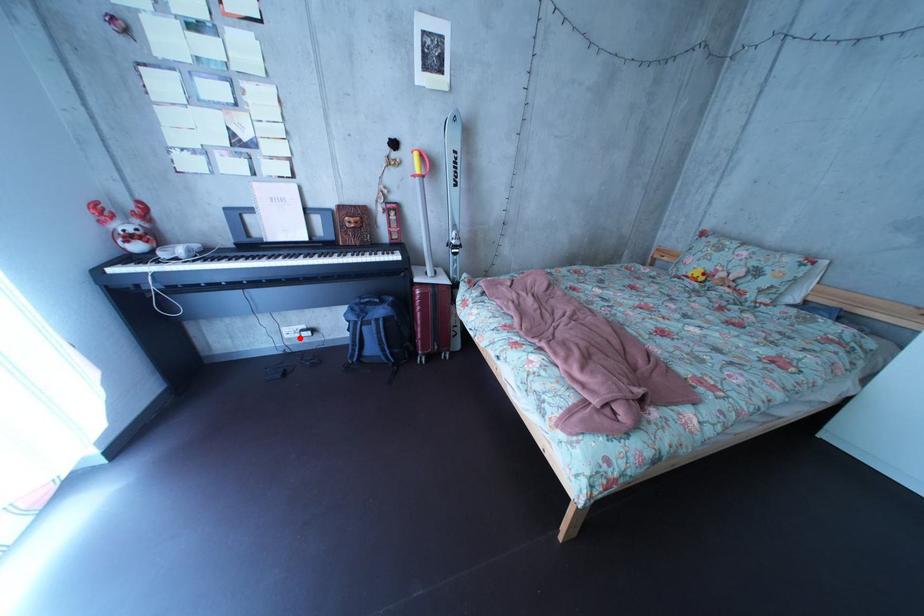
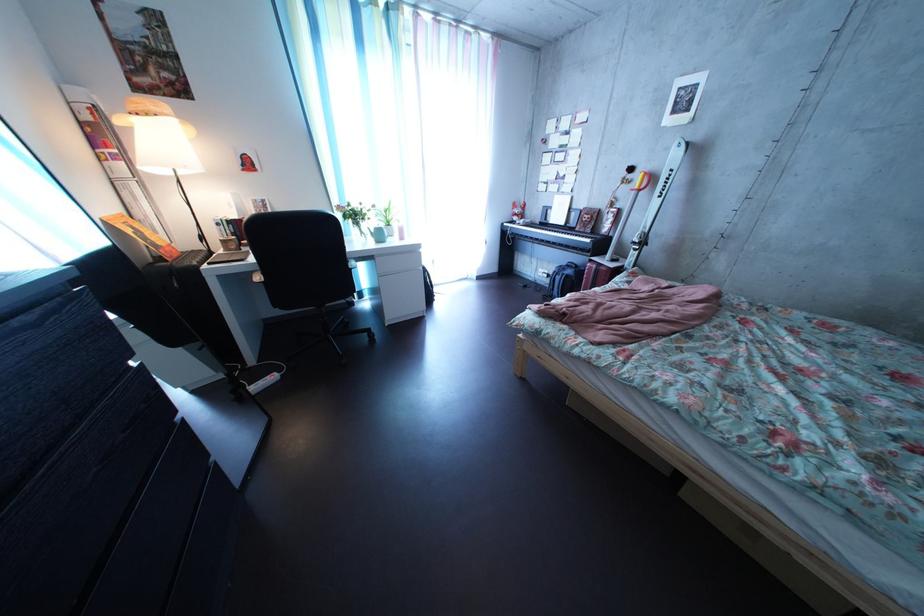
Question: I am providing you with two images of the same scene from different viewpoints. Given a red point in image1, look at the same physical point in image2. Is it:

Choices:
 (A) Closer to the viewpoint
 (B) Farther from the viewpoint

Answer: (A)